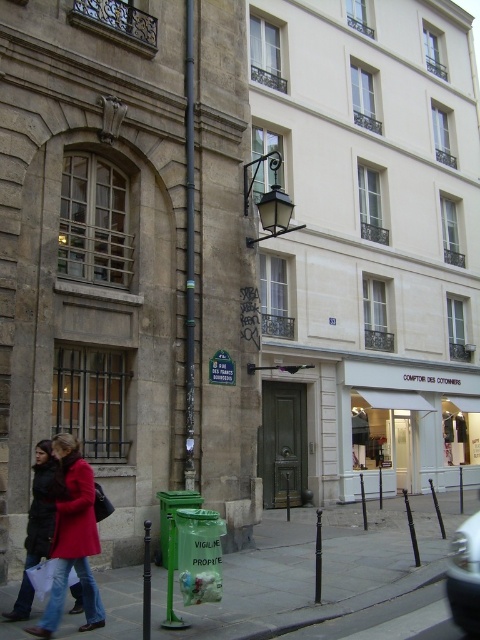
Who is taller, green plastic pole at center or green plastic sign at center?

green plastic sign at center

Who is lower down, green plastic pole at center or green plastic sign at center?

green plastic pole at center

This screenshot has height=640, width=480. What do you see at coordinates (189, 252) in the screenshot? I see `green plastic pole at center` at bounding box center [189, 252].

Locate an element on the screen. green plastic pole at center is located at coordinates (189, 252).

Does smooth concrete pavement at lower center appear on the left side of black metal streetlight at upper center?

No, smooth concrete pavement at lower center is not to the left of black metal streetlight at upper center.

Is smooth concrete pavement at lower center bigger than black metal streetlight at upper center?

Indeed, smooth concrete pavement at lower center has a larger size compared to black metal streetlight at upper center.

Which is behind, point (272, 609) or point (284, 227)?

The point (284, 227) is more distant.

Locate an element on the screen. This screenshot has height=640, width=480. smooth concrete pavement at lower center is located at coordinates (311, 572).

Does point (269, 564) come farther from viewer compared to point (190, 88)?

No.

The image size is (480, 640). What do you see at coordinates (311, 572) in the screenshot?
I see `smooth concrete pavement at lower center` at bounding box center [311, 572].

I want to click on smooth concrete pavement at lower center, so click(311, 572).